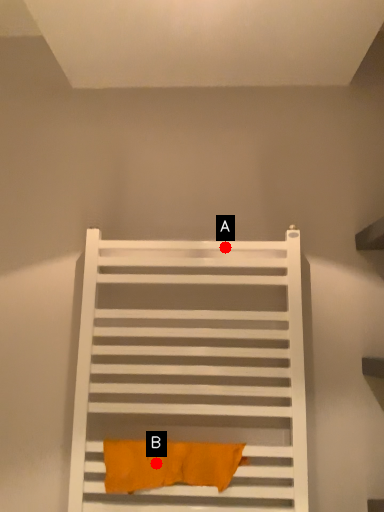
Question: Two points are circled on the image, labeled by A and B beside each circle. Among these points, which one is farthest from the camera?

Choices:
 (A) A is further
 (B) B is further

Answer: (A)